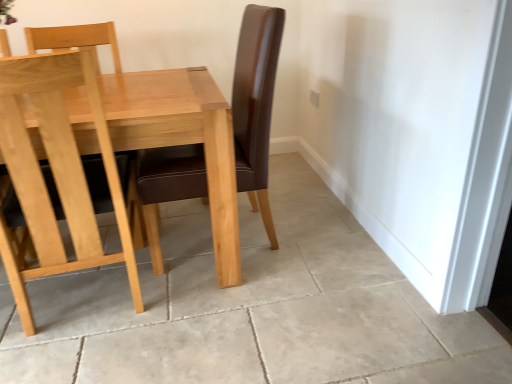
Question: Considering the relative sizes of light gray tile floor at center and natural wood table at center in the image provided, is light gray tile floor at center smaller than natural wood table at center?

Choices:
 (A) no
 (B) yes

Answer: (B)

Question: Is light gray tile floor at center in front of natural wood table at center?

Choices:
 (A) yes
 (B) no

Answer: (A)

Question: Can you confirm if light gray tile floor at center is positioned to the right of natural wood table at center?

Choices:
 (A) yes
 (B) no

Answer: (A)

Question: From a real-world perspective, does light gray tile floor at center stand above natural wood table at center?

Choices:
 (A) yes
 (B) no

Answer: (B)

Question: Can natural wood table at center be found inside light gray tile floor at center?

Choices:
 (A) no
 (B) yes

Answer: (A)

Question: In terms of size, does light gray tile floor at center appear bigger or smaller than light brown wood chair at left?

Choices:
 (A) small
 (B) big

Answer: (A)

Question: Choose the correct answer: Is light gray tile floor at center inside light brown wood chair at left or outside it?

Choices:
 (A) inside
 (B) outside

Answer: (B)

Question: In terms of height, does light gray tile floor at center look taller or shorter compared to light brown wood chair at left?

Choices:
 (A) short
 (B) tall

Answer: (A)

Question: Based on their positions, is light gray tile floor at center located to the left or right of light brown wood chair at left?

Choices:
 (A) left
 (B) right

Answer: (B)

Question: Looking at their shapes, would you say light brown wood chair at left is wider or thinner than natural wood table at center?

Choices:
 (A) thin
 (B) wide

Answer: (A)

Question: Considering the positions of light brown wood chair at left and natural wood table at center in the image, is light brown wood chair at left bigger or smaller than natural wood table at center?

Choices:
 (A) big
 (B) small

Answer: (B)

Question: Considering the relative positions of light brown wood chair at left and natural wood table at center in the image provided, is light brown wood chair at left to the left or to the right of natural wood table at center?

Choices:
 (A) left
 (B) right

Answer: (B)

Question: From the image's perspective, is light brown wood chair at left located above or below natural wood table at center?

Choices:
 (A) below
 (B) above

Answer: (A)

Question: In the image, is light gray tile floor at center on the left side or the right side of natural wood table at center?

Choices:
 (A) left
 (B) right

Answer: (B)

Question: In terms of size, does light gray tile floor at center appear bigger or smaller than natural wood table at center?

Choices:
 (A) small
 (B) big

Answer: (A)